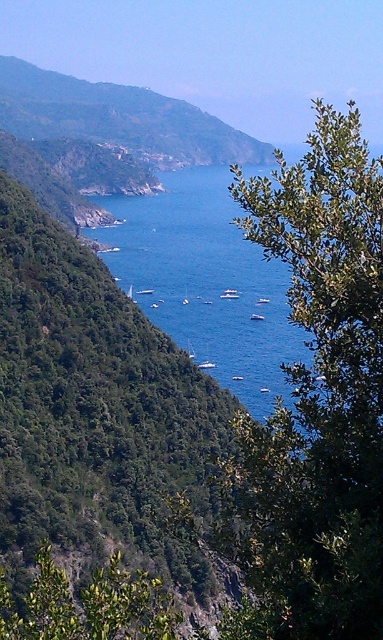
You are a hiker standing at the base of the green leafy tree at right. You want to reach the blue water at center. Given that the distance between them is 260.08 meters, can you estimate how long it would take to walk there at a leisurely pace of 3 km per hour?

The distance between the green leafy tree at right and the blue water at center is 260.08 meters. At a leisurely pace of 3 km per hour, it would take approximately 5.2 minutes to walk there.

You are standing at the elevated vantage point overlooking the coastal scene. You see the green leafy tree at right and the green leafy tree at lower left. Which tree is positioned closer to you?

The green leafy tree at right is closer to the viewer than the green leafy tree at lower left.

You are standing at the point marked by the coordinate point at (x=317, y=401) in the image. Looking around, you notice a green leafy tree at right. What direction should you face to see the green leafy tree at right from your current position?

Since the point at (x=317, y=401) marks the green leafy tree at right, you are already facing the tree. To see the green leafy tree at right, you should face towards the right direction from your current position.